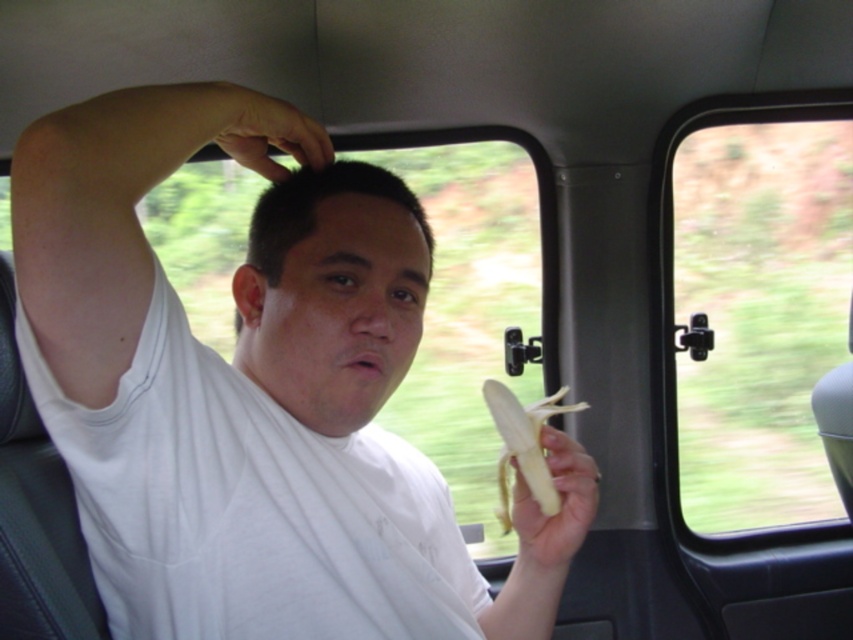
In order to click on matte black hand at upper center in this screenshot , I will do `click(256, 129)`.

Is point (196, 90) behind point (521, 506)?

No, (196, 90) is in front of (521, 506).

Find the location of a particular element. matte black hand at upper center is located at coordinates (256, 129).

Which is more to the right, transparent glass window at right or matte white head at center?

transparent glass window at right

Does transparent glass window at right appear on the left side of matte white head at center?

Incorrect, transparent glass window at right is not on the left side of matte white head at center.

Is point (753, 483) closer to camera compared to point (247, 317)?

No, it is not.

Find the location of a particular element. The width and height of the screenshot is (853, 640). transparent glass window at right is located at coordinates (755, 308).

Which is more to the left, white matte shirt at center or matte white head at center?

white matte shirt at center

Is white matte shirt at center positioned in front of matte white head at center?

Yes.

Where is `white matte shirt at center`? white matte shirt at center is located at coordinates (93, 237).